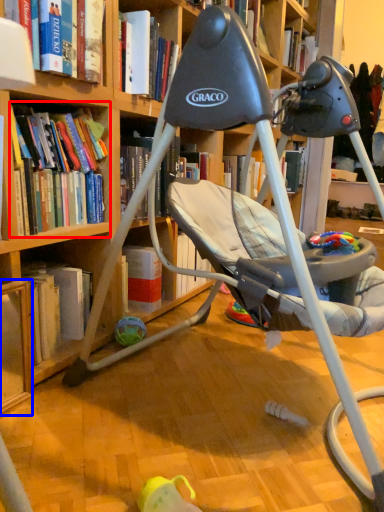
Question: Among these objects, which one is nearest to the camera, book (highlighted by a red box) or shelf (highlighted by a blue box)?

Choices:
 (A) book
 (B) shelf

Answer: (B)